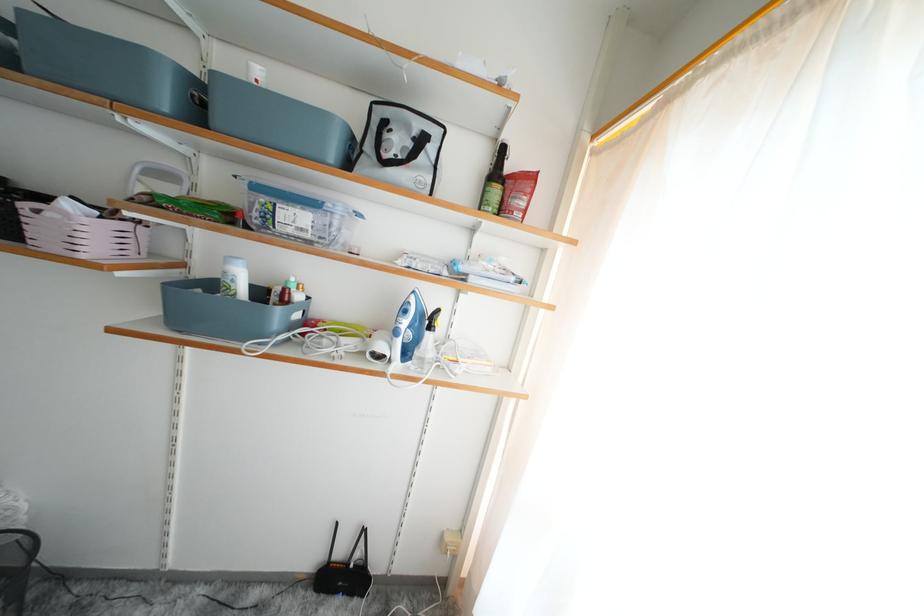
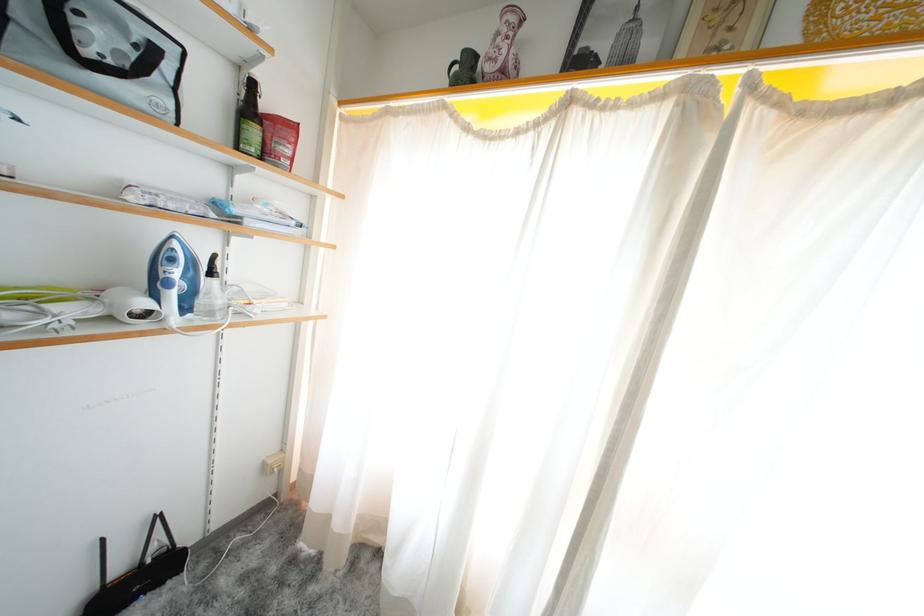
Where in the second image is the point corresponding to point 507,215 from the first image?

(273, 158)